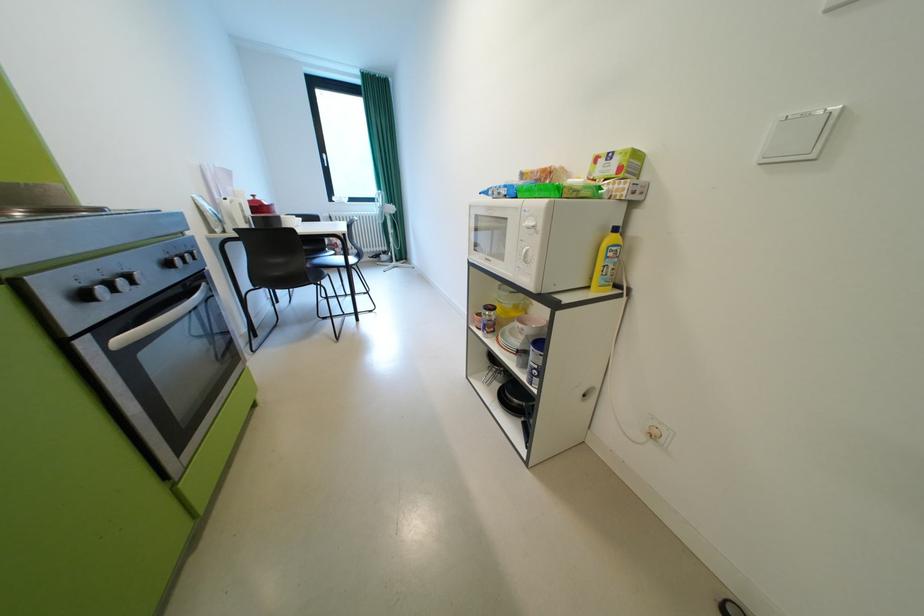
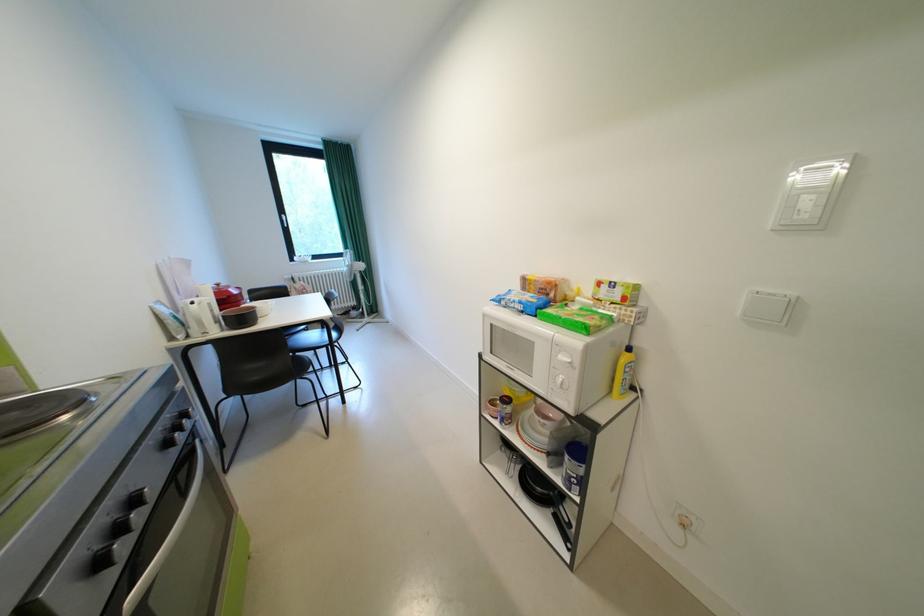
Find the pixel in the second image that matches [263,197] in the first image.

(228, 286)